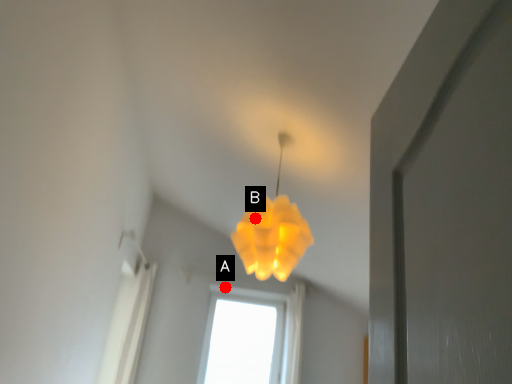
Question: Two points are circled on the image, labeled by A and B beside each circle. Which point appears closest to the camera in this image?

Choices:
 (A) A is closer
 (B) B is closer

Answer: (B)